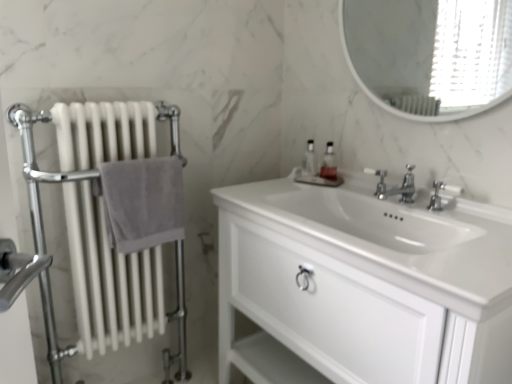
Locate an element on the screen. The width and height of the screenshot is (512, 384). free space that is in between translucent plastic soap dispenser at center, the first soap dispenser in the right-to-left sequence, and polished chrome faucet at center is located at coordinates pyautogui.click(x=348, y=192).